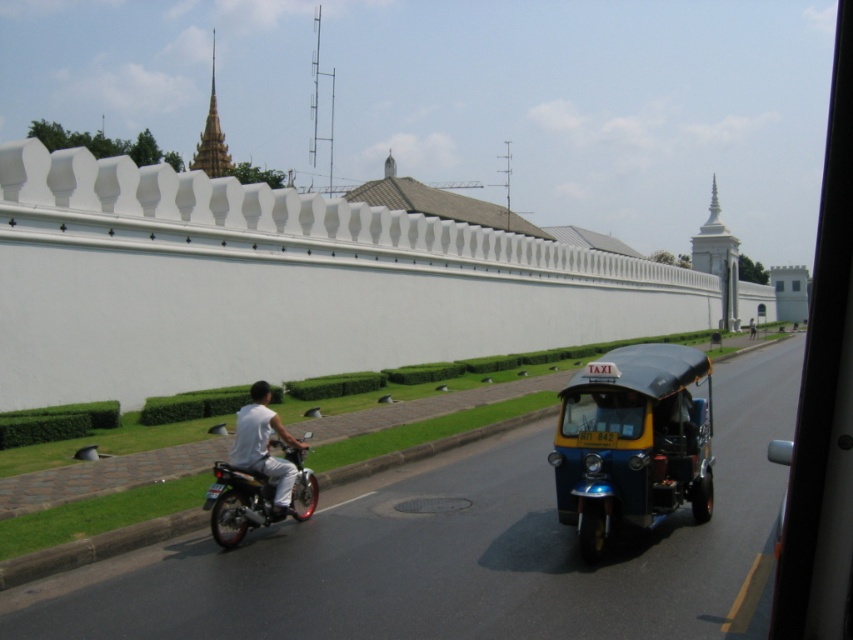
Question: Can you confirm if blue metallic tuk-tuk at center is positioned to the left of white matte motorcycle at lower left?

Choices:
 (A) yes
 (B) no

Answer: (B)

Question: Which point is farther to the camera?

Choices:
 (A) pos(252,454)
 (B) pos(698,522)
 (C) pos(227,472)

Answer: (B)

Question: Does blue metallic tuk-tuk at center lie behind white matte motorcycle at lower left?

Choices:
 (A) no
 (B) yes

Answer: (A)

Question: Which point appears closest to the camera in this image?

Choices:
 (A) pyautogui.click(x=685, y=380)
 (B) pyautogui.click(x=277, y=506)

Answer: (A)

Question: Which object is positioned farthest from the white matte motorcycle at lower left?

Choices:
 (A) shiny black motorcycle at lower left
 (B) blue metallic tuk-tuk at center

Answer: (B)

Question: Does shiny black motorcycle at lower left have a larger size compared to white matte motorcycle at lower left?

Choices:
 (A) no
 (B) yes

Answer: (B)